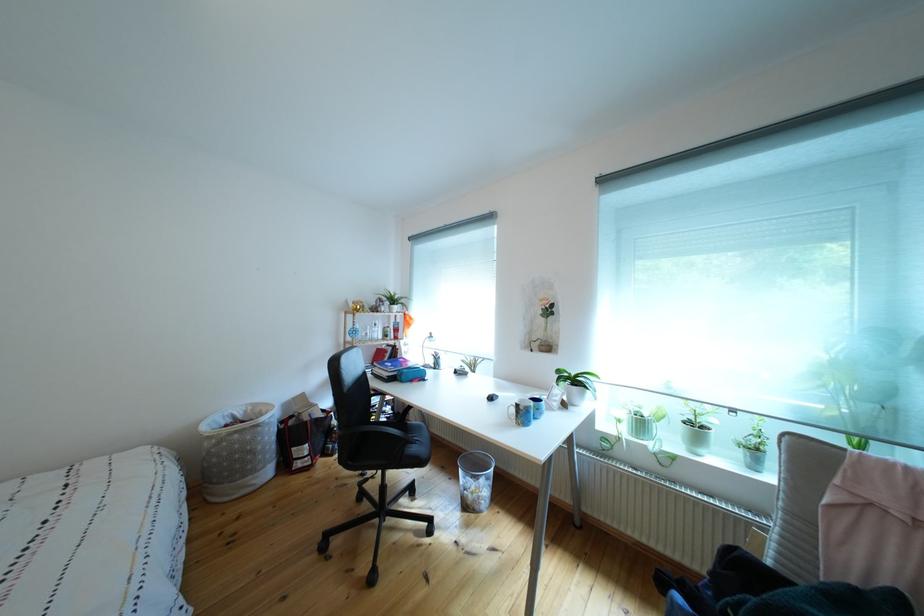
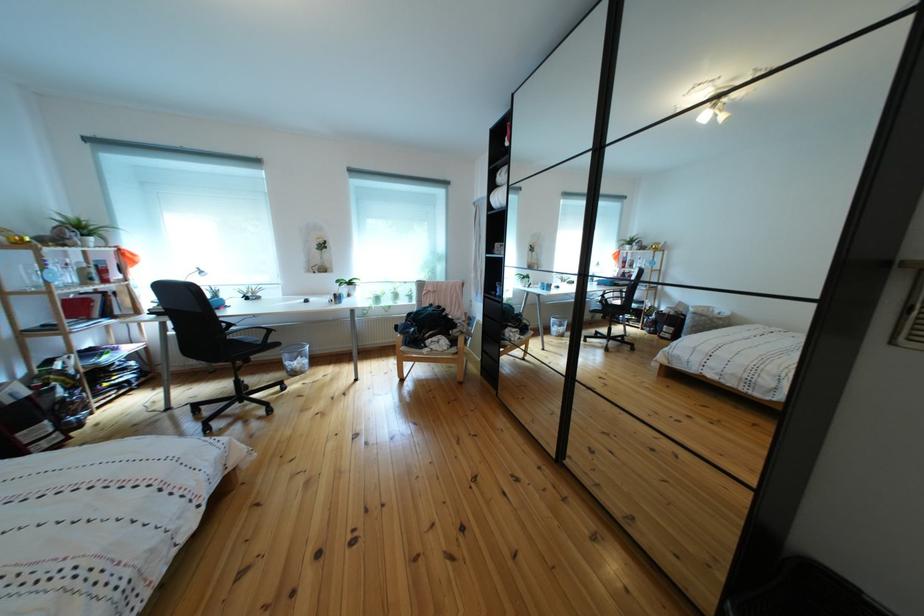
Find the pixel in the second image that matches pixel 472 477 in the first image.

(297, 362)